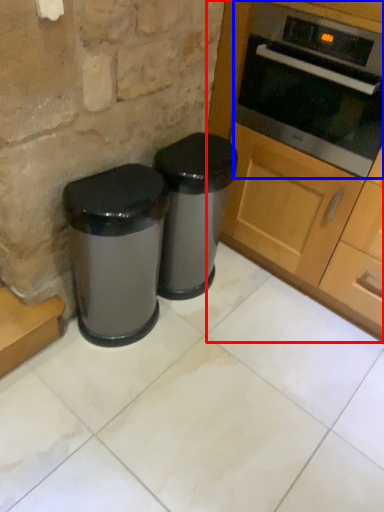
Question: Which object is further to the camera taking this photo, cabinetry (highlighted by a red box) or oven (highlighted by a blue box)?

Choices:
 (A) cabinetry
 (B) oven

Answer: (B)